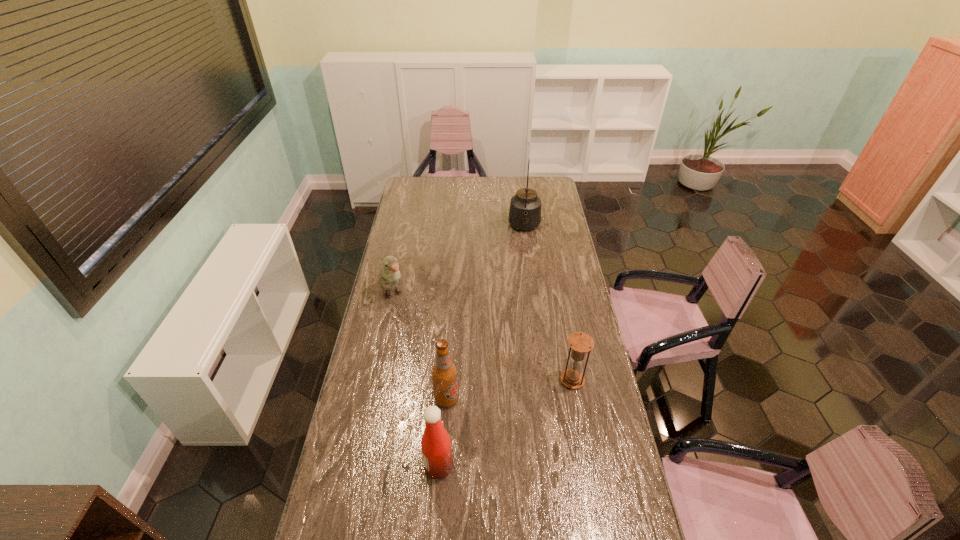
Locate an element on the screen. free space located 0.080m on the back of the hourglass is located at coordinates (567, 354).

The width and height of the screenshot is (960, 540). Identify the location of free space located 0.270m on the front label of the beer bottle. (519, 448).

Identify the location of vacant space located on the front label of the beer bottle. (469, 415).

Identify the location of free space located on the front label of the beer bottle. The image size is (960, 540). (527, 454).

Identify the location of free region located spout on the kettle. (523, 265).

Identify the location of free region located spout on the kettle. (523, 281).

At what (x,y) coordinates should I click in order to perform the action: click on free spot located spout on the kettle. Please return your answer as a coordinate pair (x, y). The image size is (960, 540). Looking at the image, I should click on (524, 255).

Locate an element on the screen. The height and width of the screenshot is (540, 960). blank space located 0.060m at the face of the bird is located at coordinates (404, 315).

This screenshot has height=540, width=960. What are the coordinates of `free space located at the face of the bird` in the screenshot? It's located at (420, 336).

At what (x,y) coordinates should I click in order to perform the action: click on vacant space located at the face of the bird. Please return your answer as a coordinate pair (x, y). This screenshot has height=540, width=960. Looking at the image, I should click on (422, 339).